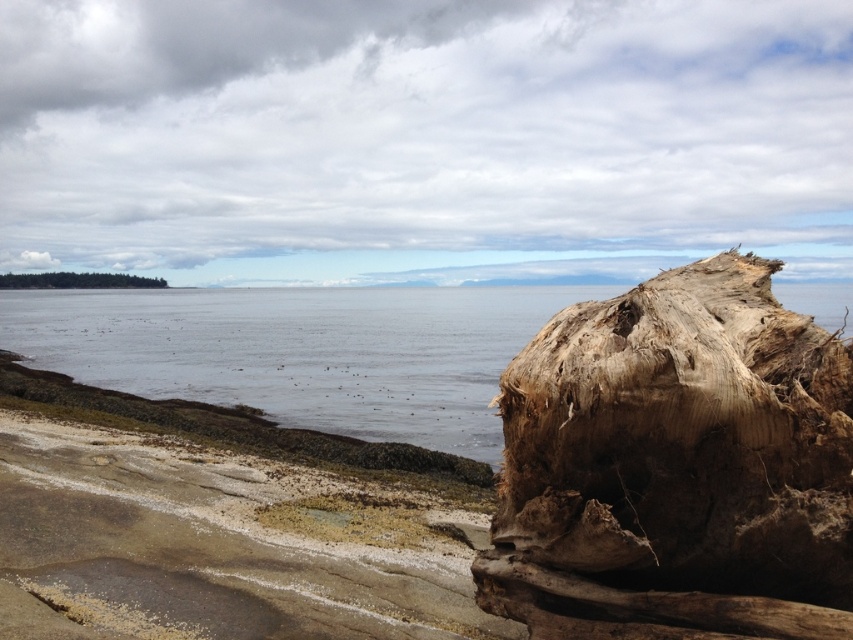
Measure the distance between driftwood log at right and camera.

driftwood log at right and camera are 4.64 meters apart.

Is point (503, 449) closer to viewer compared to point (97, 275)?

Yes, it is.

Is point (550, 426) in front of point (38, 275)?

Yes, point (550, 426) is in front of point (38, 275).

Where is `driftwood log at right`? This screenshot has height=640, width=853. driftwood log at right is located at coordinates (676, 467).

Between driftwood log at right and clear water at center, which one appears on the left side from the viewer's perspective?

From the viewer's perspective, clear water at center appears more on the left side.

Can you confirm if driftwood log at right is thinner than clear water at center?

Yes, driftwood log at right is thinner than clear water at center.

At what (x,y) coordinates should I click in order to perform the action: click on driftwood log at right. Please return your answer as a coordinate pair (x, y). This screenshot has width=853, height=640. Looking at the image, I should click on tap(676, 467).

Is point (422, 374) in front of point (123, 282)?

Yes, it is.

Between clear water at center and brown rough log at left, which one appears on the left side from the viewer's perspective?

From the viewer's perspective, brown rough log at left appears more on the left side.

Does point (62, 348) lie behind point (80, 276)?

No, (62, 348) is closer to viewer.

The width and height of the screenshot is (853, 640). I want to click on clear water at center, so click(x=300, y=352).